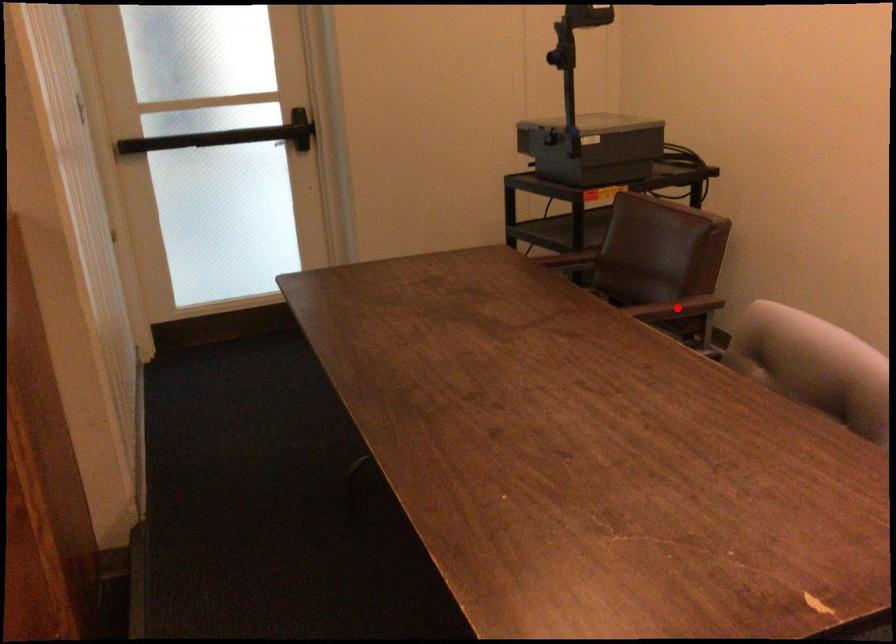
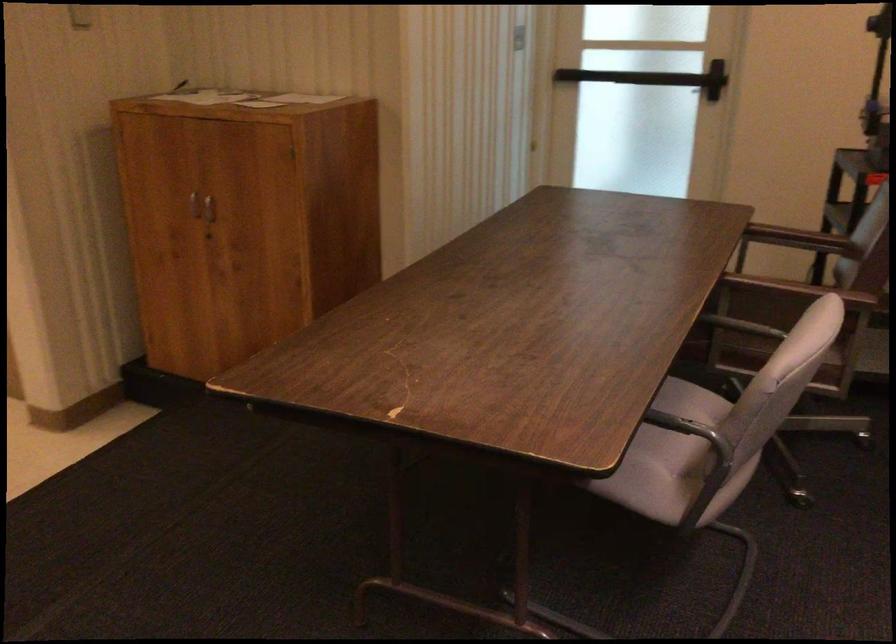
Question: I am providing you with two images of the same scene from different viewpoints. A red point is marked on the first image. Can you still see the location of the red point in image 2?

Choices:
 (A) Yes
 (B) No

Answer: (B)